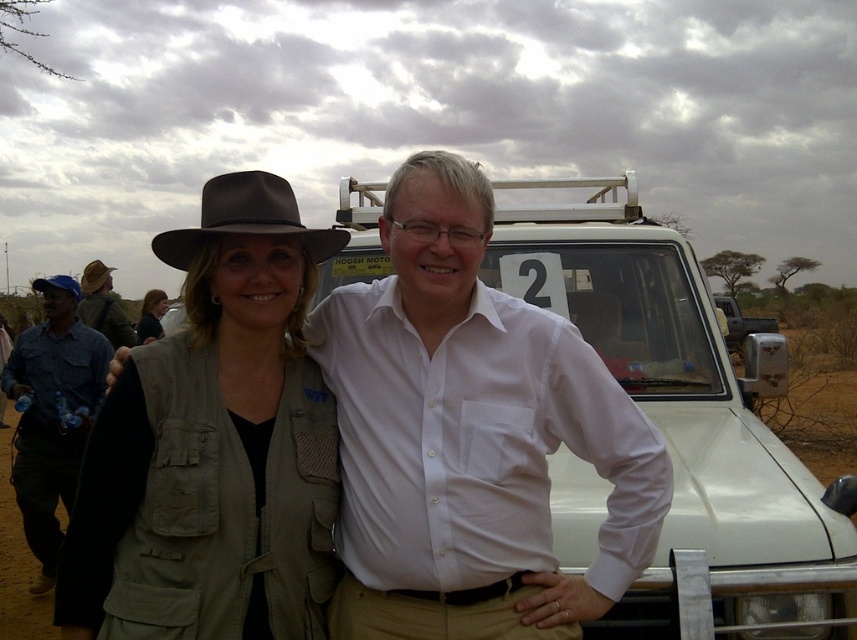
You are a photographer trying to capture a clear shot of the brown felt fedora at center. However, the suede hat at upper left is blocking your view. Can you adjust your position to avoid the obstruction?

The suede hat at upper left is in front of the brown felt fedora at center, so moving your camera position slightly to the side or adjusting the angle could help avoid the obstruction and capture the brown felt fedora at center clearly.

Based on the photo, you are a photographer trying to capture a clear shot of both the suede hat at upper left and the brown felt fedora at center. Based on their positions, which hat is positioned lower in the image?

The suede hat at upper left is located below the brown felt fedora at center, so the suede hat at upper left is positioned lower in the image.

You are a photographer trying to capture a clear shot of both the white cotton shirt at center and the suede hat at upper left. Since the camera can only focus on one object at a time, which object should you choose to ensure the larger one is in focus?

The white cotton shirt at center is larger in size than the suede hat at upper left, so you should focus on the white cotton shirt at center to ensure the larger object is in focus.